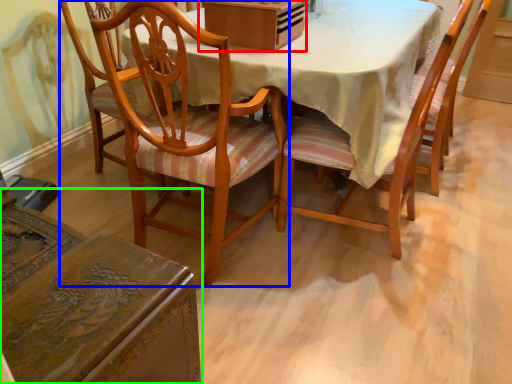
Question: Which object is positioned closest to box (highlighted by a red box)? Select from chair (highlighted by a blue box) and chair (highlighted by a green box).

Choices:
 (A) chair
 (B) chair

Answer: (A)